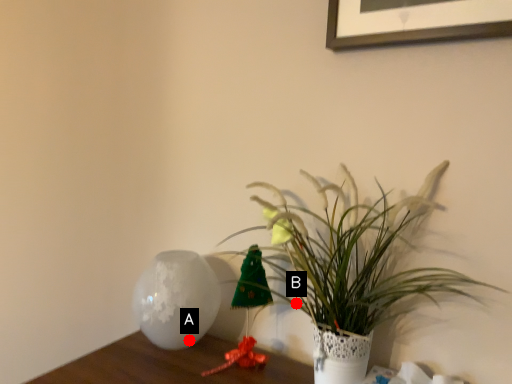
Question: Two points are circled on the image, labeled by A and B beside each circle. Which point is closer to the camera?

Choices:
 (A) A is closer
 (B) B is closer

Answer: (A)